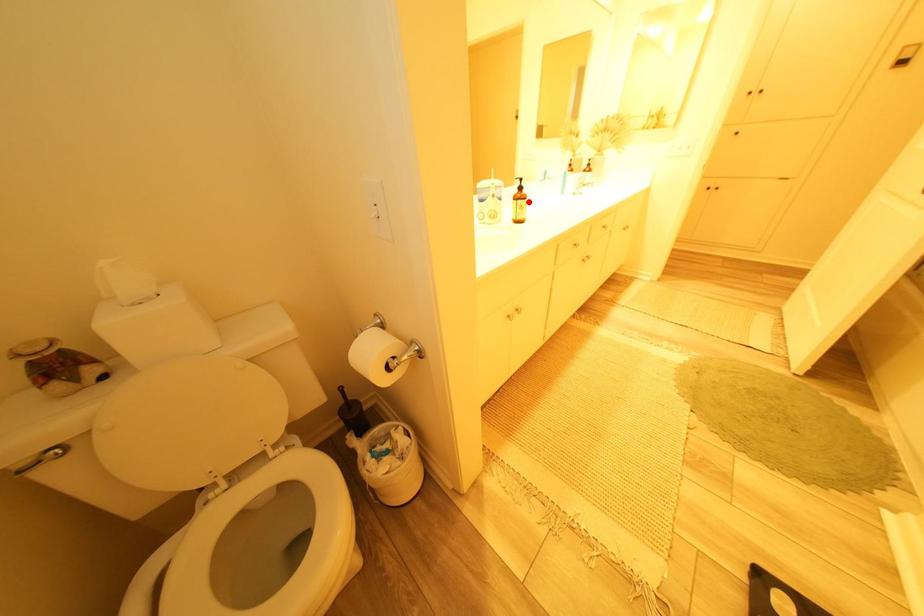
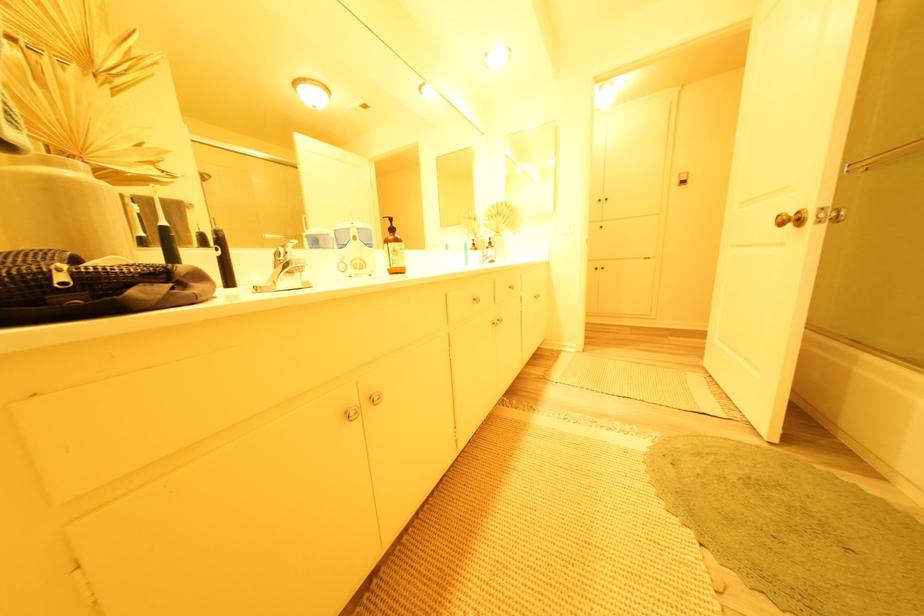
Question: I am providing you with two images of the same scene from different viewpoints. A red point is shown in image1. For the corresponding object point in image2, is it positioned nearer or farther from the camera?

Choices:
 (A) Nearer
 (B) Farther

Answer: (B)